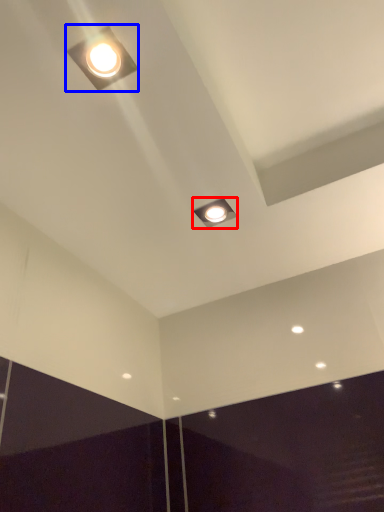
Question: Which of the following is the farthest to the observer, lamp (highlighted by a red box) or lamp (highlighted by a blue box)?

Choices:
 (A) lamp
 (B) lamp

Answer: (A)